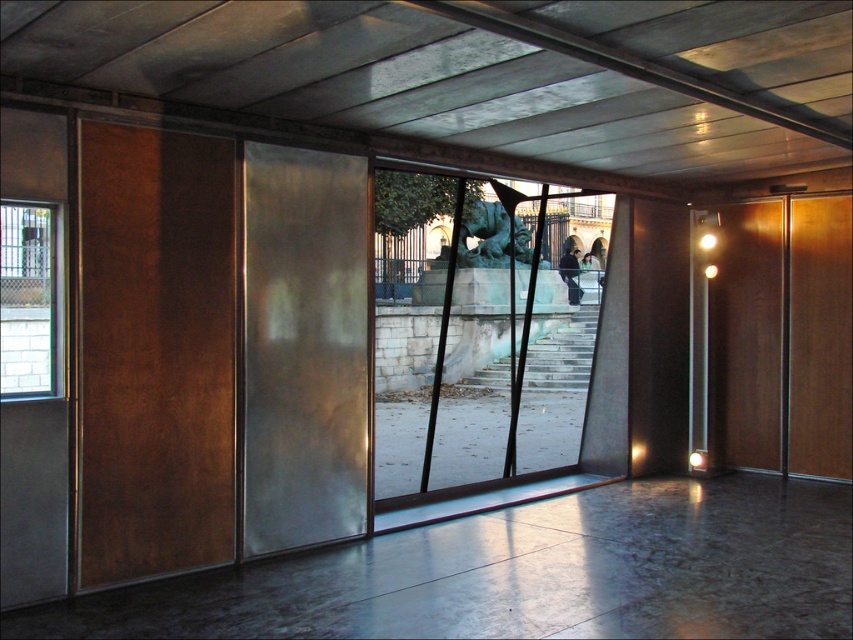
You are an interior designer planning to install a new light fixture. You need to decide whether to place it in front of the satin silver door at center or the bronze statue at center. Based on their positions, which object is closer to you, and thus more suitable for the light fixture placement?

The satin silver door at center is in front of the bronze statue at center, so it is closer to you. Therefore, placing the light fixture in front of the satin silver door at center would be more suitable as it is the closer object.

You are standing in the room and want to exit through the door. Which direction should you move towards to reach the rustic wood screen door at left and bronze statue at center?

You should move towards the left since the rustic wood screen door at left is to the left of bronze statue at center.

You are a visitor entering the room and want to locate both the satin silver door at center and the dark gray fabric jacket at center. Which object is bigger in size?

The satin silver door at center is larger in size compared to the dark gray fabric jacket at center according to the description.